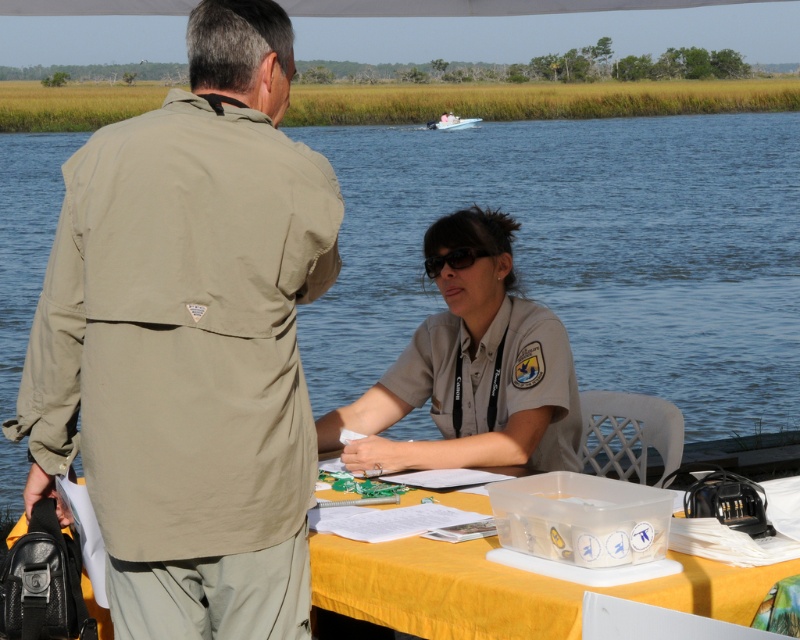
Can you confirm if khaki fabric jacket at left is positioned to the left of yellow fabric table at lower center?

Indeed, khaki fabric jacket at left is positioned on the left side of yellow fabric table at lower center.

Is khaki fabric jacket at left closer to camera compared to yellow fabric table at lower center?

No.

Locate an element on the screen. khaki fabric jacket at left is located at coordinates (190, 340).

I want to click on tan uniform at center, so click(472, 368).

The height and width of the screenshot is (640, 800). What do you see at coordinates (472, 368) in the screenshot?
I see `tan uniform at center` at bounding box center [472, 368].

What are the coordinates of `tan uniform at center` in the screenshot? It's located at (472, 368).

Which is behind, point (132, 160) or point (432, 128)?

Positioned behind is point (432, 128).

Can you confirm if khaki fabric jacket at left is positioned to the right of white plastic boat at upper center?

No, khaki fabric jacket at left is not to the right of white plastic boat at upper center.

Is point (196, 388) less distant than point (448, 125)?

Yes, point (196, 388) is closer to viewer.

Identify the location of khaki fabric jacket at left. (190, 340).